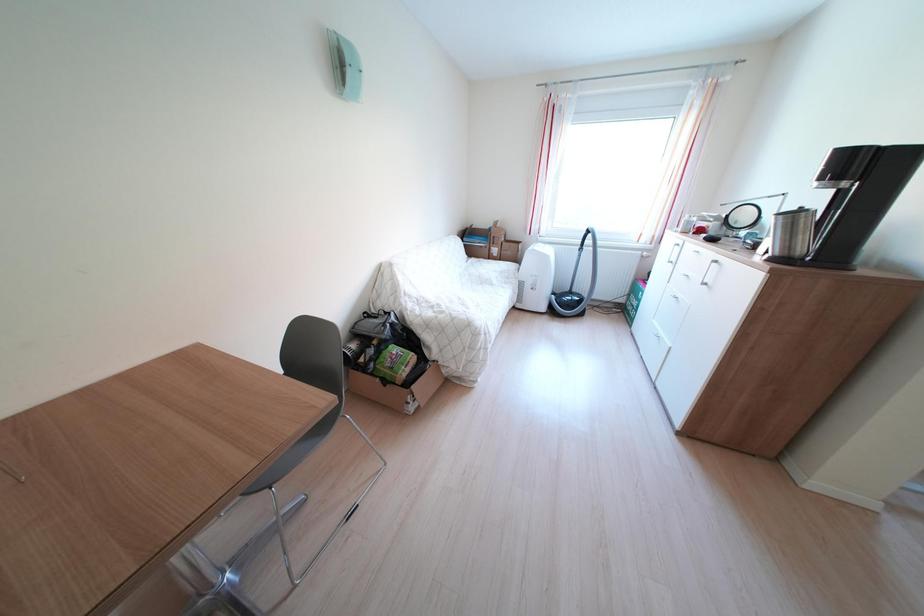
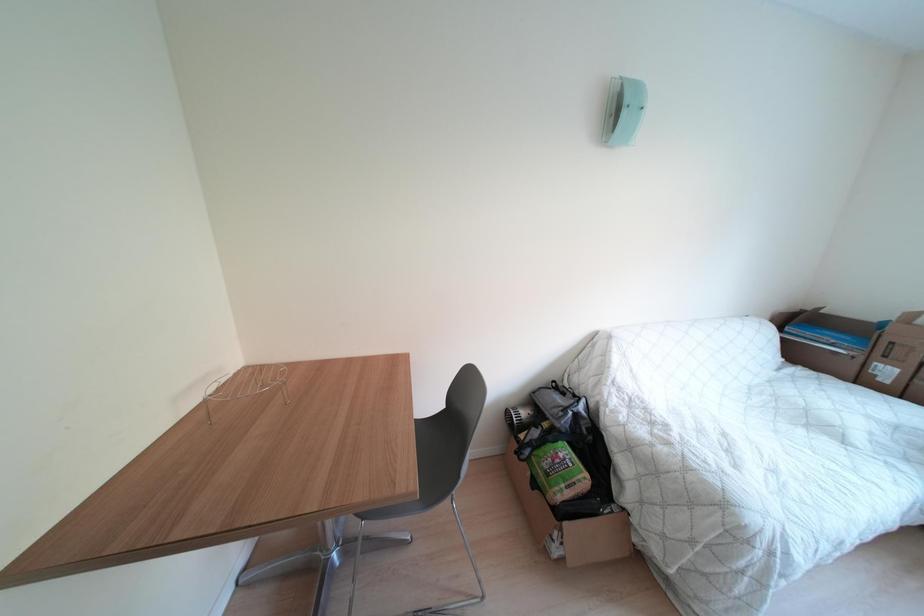
Question: How did the camera likely rotate?

Choices:
 (A) Left
 (B) Right
 (C) Up
 (D) Down

Answer: (A)